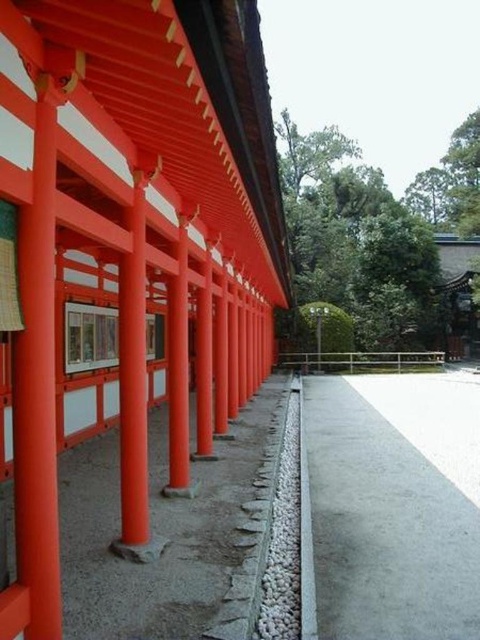
You are a visitor at a Shinto shrine and want to walk from the entrance to the shrine building. You notice the matte orange pillars at center and the gray concrete path at lower center. Which object is narrower, and would you prefer to walk on the wider one for better footing?

The matte orange pillars at center are narrower than the gray concrete path at lower center. You should walk on the gray concrete path at lower center for better footing since it is wider.

You are standing at the entrance of the shrine and want to place a small offering at the base of the matte orange pillars at center. Given that your current position is at coordinates point A, which is at point coordinates at point A, which is at point coordinates at point A, which is at point coordinates at point A, which is at point coordinates at point A, which is at point coordinates at point A, which is at point coordinates at point A, which is at point coordinates at point A, which is at point point A

The matte orange pillars at center are located at point coordinates at point A, which is at point coordinates at point A, which is at point coordinates at point A, which is at point coordinates at point A, which is at point coordinates at point A, which is at point coordinates at point A, which is at point coordinates at point point A